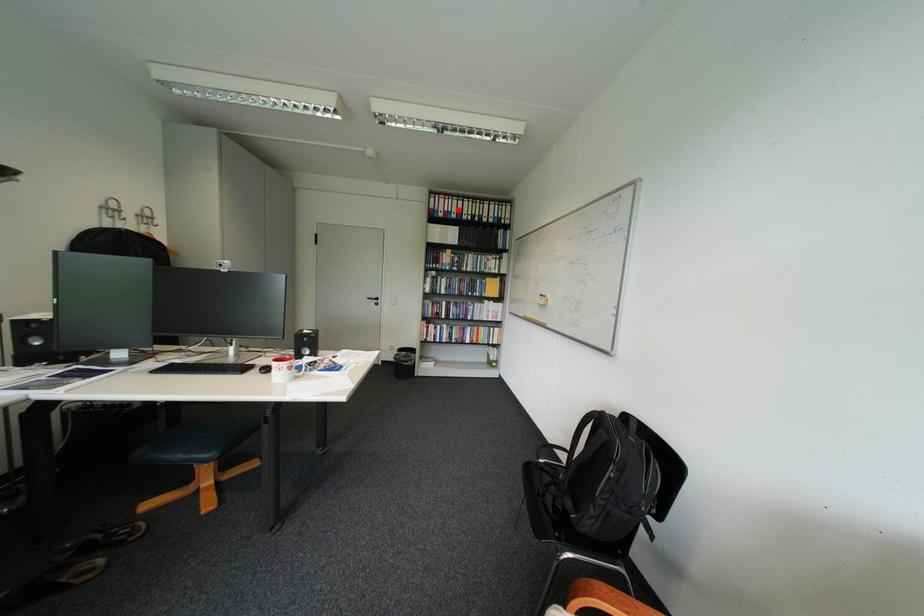
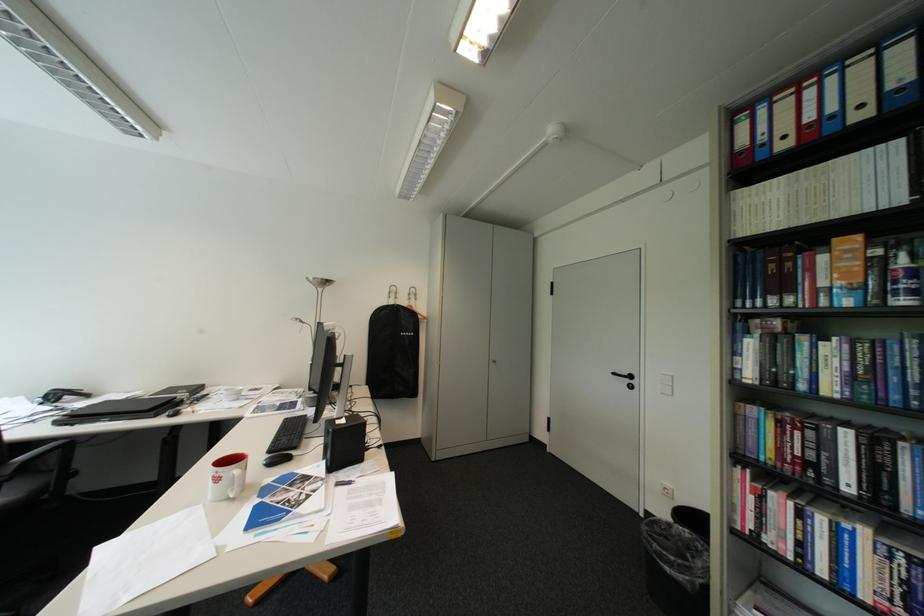
Question: I am providing you with two images of the same scene from different viewpoints. In image1, a red point is highlighted. Considering the same 3D point in image2, which of the following is correct?

Choices:
 (A) It is closer
 (B) It is farther

Answer: (B)